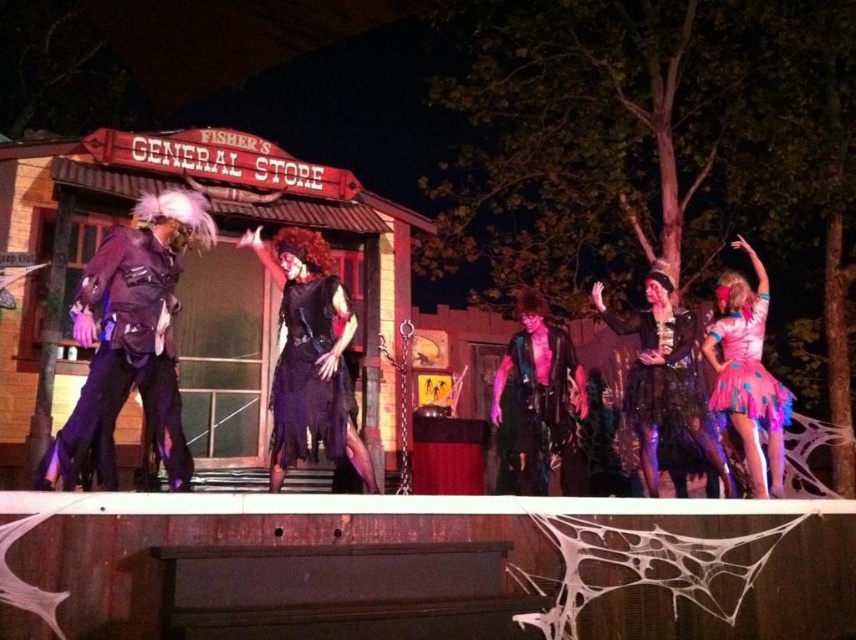
Question: Estimate the real-world distances between objects in this image. Which object is farther from the purple matte suit at left?

Choices:
 (A) pink tulle skirt at right
 (B) black lace dress at center
 (C) black velvet dress at center
 (D) pink leather vest at center

Answer: (A)

Question: Can you confirm if shiny black dress at center is positioned to the right of black velvet dress at center?

Choices:
 (A) yes
 (B) no

Answer: (A)

Question: Is black lace dress at center thinner than shiny pink tulle skirt at right?

Choices:
 (A) no
 (B) yes

Answer: (A)

Question: Which point is farther from the camera taking this photo?

Choices:
 (A) (717, 390)
 (B) (568, 426)
 (C) (295, 355)
 (D) (658, 269)

Answer: (D)

Question: Does pink leather vest at center have a smaller size compared to pink tulle skirt at right?

Choices:
 (A) no
 (B) yes

Answer: (A)

Question: Among these points, which one is farthest from the camera?

Choices:
 (A) (342, 332)
 (B) (298, 243)
 (C) (544, 474)

Answer: (C)